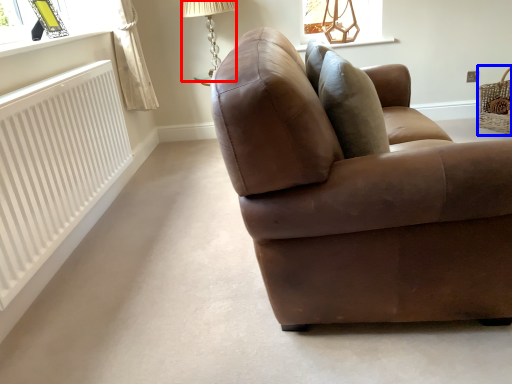
Question: Which point is further to the camera, table lamp (highlighted by a red box) or basket (highlighted by a blue box)?

Choices:
 (A) table lamp
 (B) basket

Answer: (B)